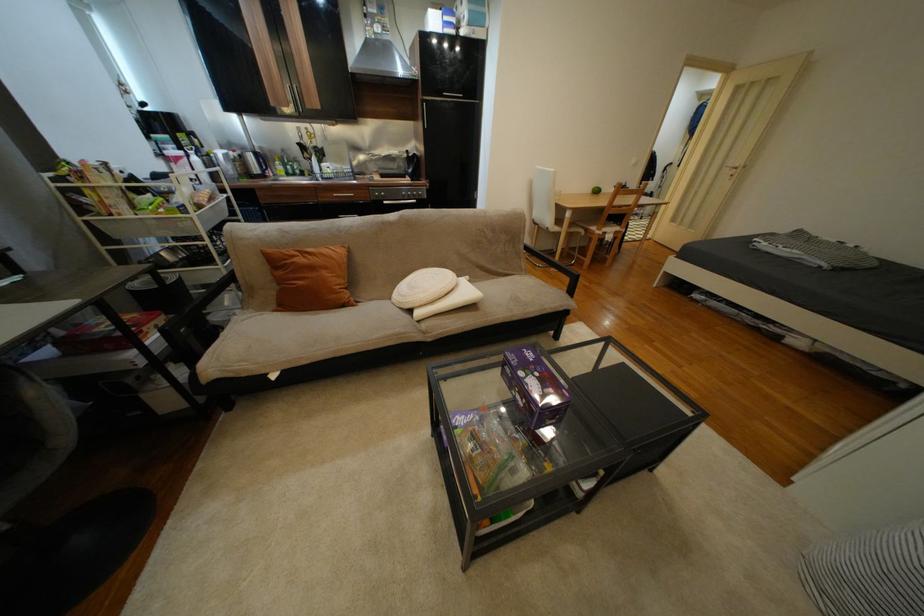
What do you see at coordinates (320, 331) in the screenshot? The image size is (924, 616). I see `a sofa sitting surface` at bounding box center [320, 331].